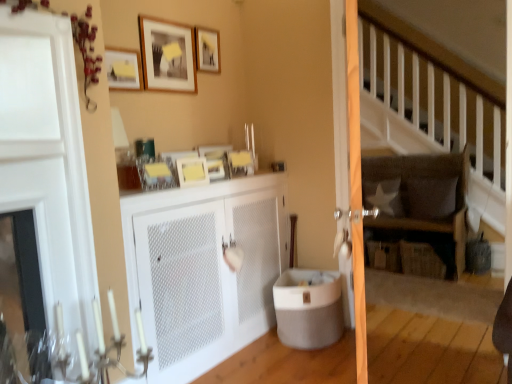
Where is `vacant area that is in front of matte yellow picture frame at upper center, arranged as the first picture frame when ordered from the bottom`? The image size is (512, 384). vacant area that is in front of matte yellow picture frame at upper center, arranged as the first picture frame when ordered from the bottom is located at coordinates (178, 185).